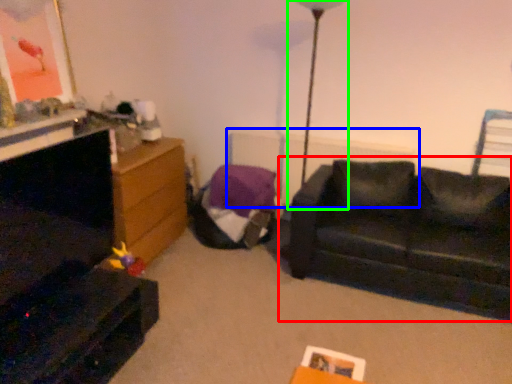
Question: Which is farther away from studio couch (highlighted by a red box)? radiator (highlighted by a blue box) or table lamp (highlighted by a green box)?

Choices:
 (A) radiator
 (B) table lamp

Answer: (B)